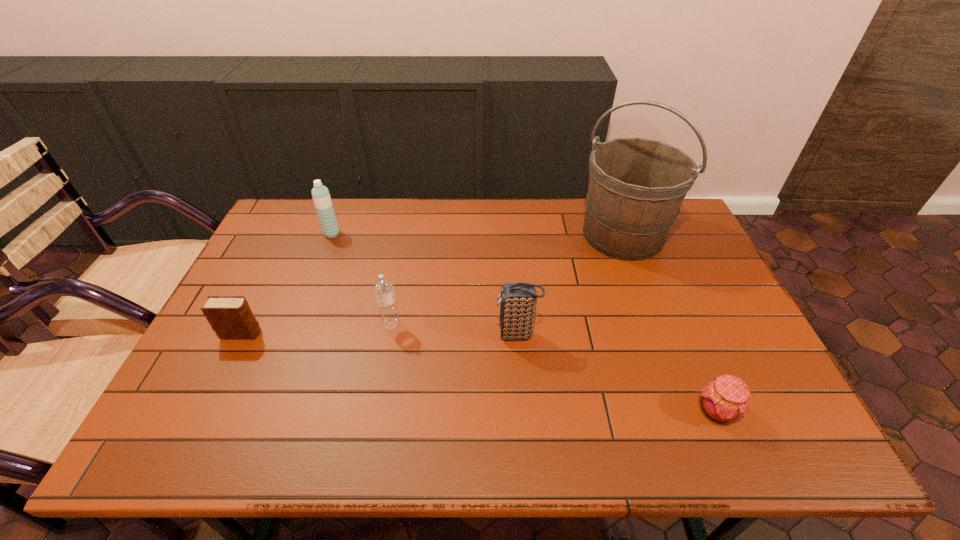
Find the location of a particular element. vacant space situated on the left of the tallest object is located at coordinates (499, 235).

At what (x,y) coordinates should I click in order to perform the action: click on vacant area situated on the right of the left water bottle. Please return your answer as a coordinate pair (x, y). Image resolution: width=960 pixels, height=540 pixels. Looking at the image, I should click on (439, 233).

I want to click on free location located 0.230m with the zip open on the clutch bag, so click(x=409, y=335).

The width and height of the screenshot is (960, 540). Find the location of `blank space located with the zip open on the clutch bag`. blank space located with the zip open on the clutch bag is located at coordinates (472, 335).

You are a GUI agent. You are given a task and a screenshot of the screen. Output one action in this format:
    pyautogui.click(x=<x>, y=<y>)
    Task: Click on the free space located with the zip open on the clutch bag
    
    Given the screenshot: What is the action you would take?
    pyautogui.click(x=409, y=335)

Locate an element on the screen. vacant space situated 0.140m on the back of the third object from left to right is located at coordinates (399, 281).

Identify the location of blank space located on the spine side of the diary. (400, 334).

Where is `vacant space situated 0.390m on the back of the nearest object`? vacant space situated 0.390m on the back of the nearest object is located at coordinates (660, 279).

You are a GUI agent. You are given a task and a screenshot of the screen. Output one action in this format:
    pyautogui.click(x=<x>, y=<y>)
    Task: Click on the bucket present at the far edge
    The width and height of the screenshot is (960, 540).
    Given the screenshot: What is the action you would take?
    pyautogui.click(x=636, y=187)

What are the coordinates of `water bottle present at the far edge` in the screenshot? It's located at (320, 194).